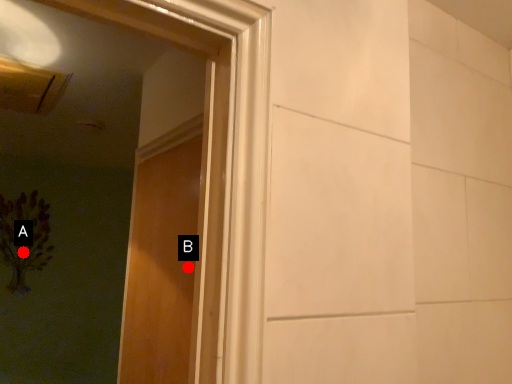
Question: Two points are circled on the image, labeled by A and B beside each circle. Which point is closer to the camera taking this photo?

Choices:
 (A) A is closer
 (B) B is closer

Answer: (B)